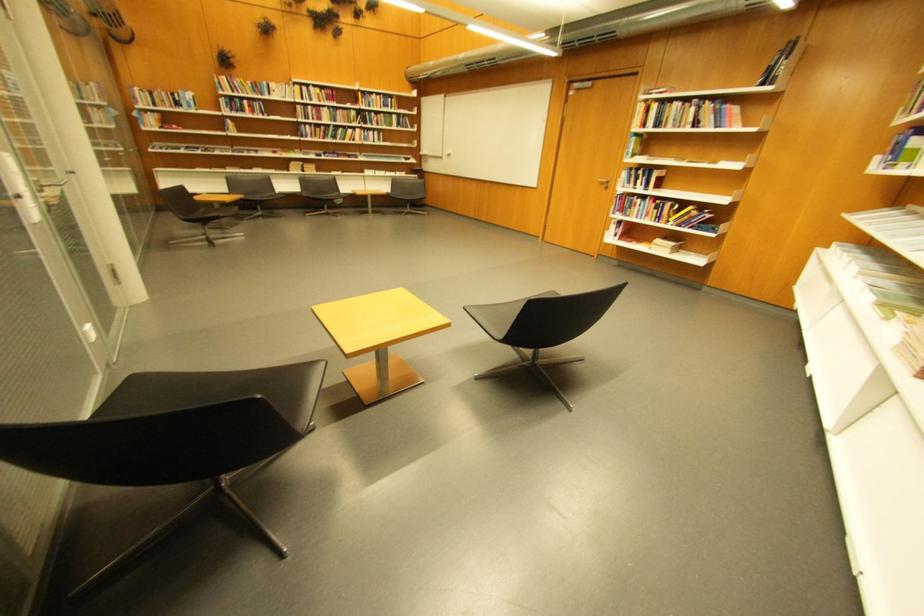
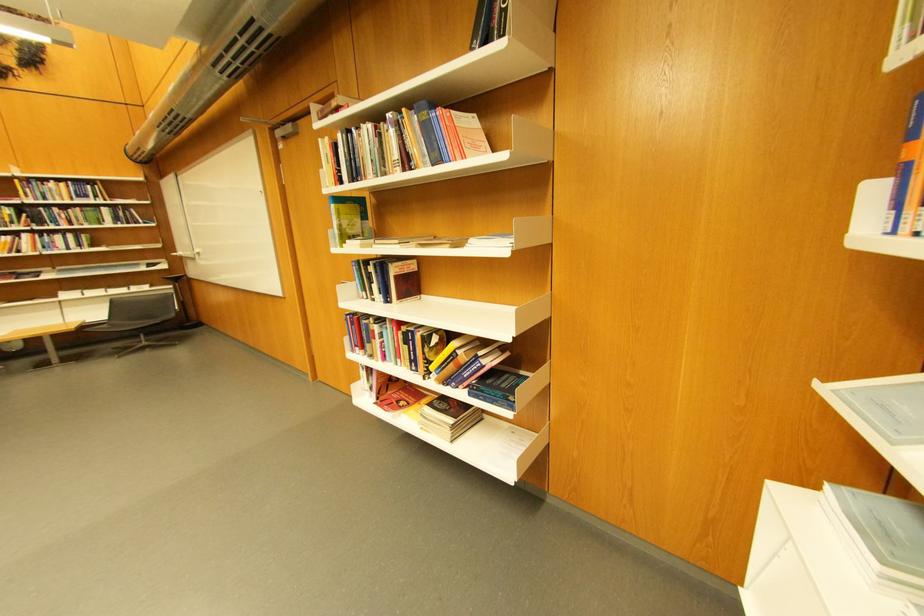
In the second image, find the point that corresponds to the point at 895,156 in the first image.

(913, 172)